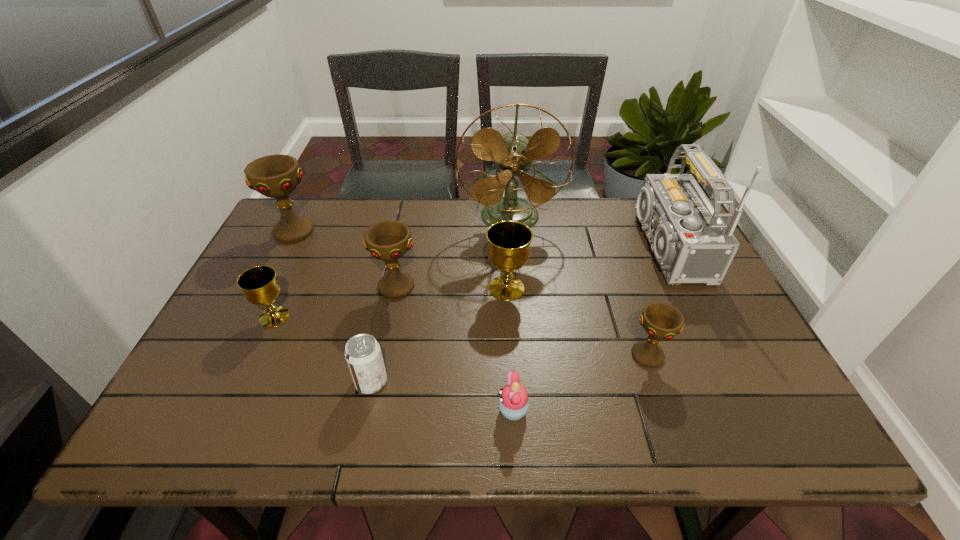
Select which chalice is the fifth closest to the shortest object. Please provide its 2D coordinates. Your answer should be formatted as a tuple, i.e. [(x, y)], where the tuple contains the x and y coordinates of a point satisfying the conditions above.

[(276, 176)]

Identify which chalice is the third nearest to the farthest chalice. Please provide its 2D coordinates. Your answer should be formatted as a tuple, i.e. [(x, y)], where the tuple contains the x and y coordinates of a point satisfying the conditions above.

[(508, 250)]

Identify which red chalice is located as the second nearest to the third chalice from left to right. Please provide its 2D coordinates. Your answer should be formatted as a tuple, i.e. [(x, y)], where the tuple contains the x and y coordinates of a point satisfying the conditions above.

[(660, 320)]

You are a GUI agent. You are given a task and a screenshot of the screen. Output one action in this format:
    pyautogui.click(x=<x>, y=<y>)
    Task: Click on the red chalice that stands as the third closest to the soda can
    This screenshot has height=540, width=960.
    Given the screenshot: What is the action you would take?
    pyautogui.click(x=660, y=320)

At what (x,y) coordinates should I click in order to perform the action: click on free space in the image that satisfies the following two spatial constraints: 1. on the front side of the left gold chalice; 2. on the left side of the biggest red chalice. Please return your answer as a coordinate pair (x, y). The image size is (960, 540). Looking at the image, I should click on (251, 317).

The image size is (960, 540). Find the location of `free region that satisfies the following two spatial constraints: 1. on the front-facing side of the radio receiver; 2. on the front side of the smaller gold chalice`. free region that satisfies the following two spatial constraints: 1. on the front-facing side of the radio receiver; 2. on the front side of the smaller gold chalice is located at coordinates (694, 317).